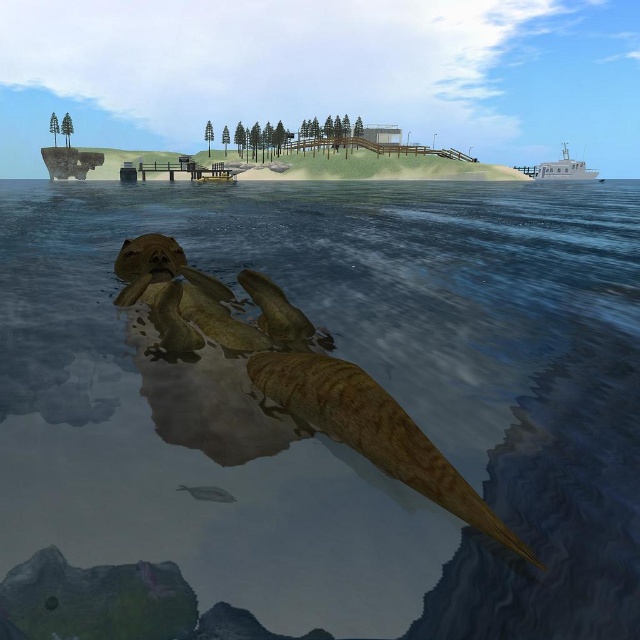
Does brown textured water at center have a greater height compared to white matte boat at upper right?

No, brown textured water at center is not taller than white matte boat at upper right.

Does brown textured water at center have a lesser height compared to white matte boat at upper right?

Correct, brown textured water at center is not as tall as white matte boat at upper right.

Identify the location of brown textured water at center. point(316,428).